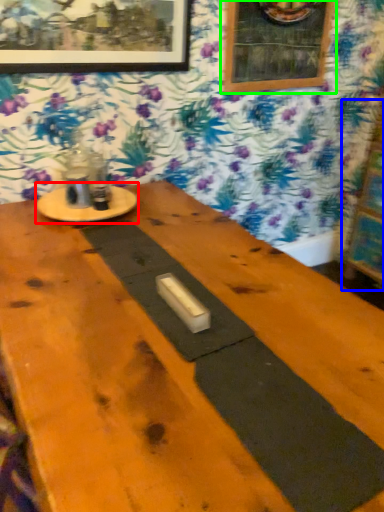
Question: Considering the real-world distances, which object is closest to round table (highlighted by a red box)? bulletin board (highlighted by a blue box) or picture frame (highlighted by a green box).

Choices:
 (A) bulletin board
 (B) picture frame

Answer: (B)